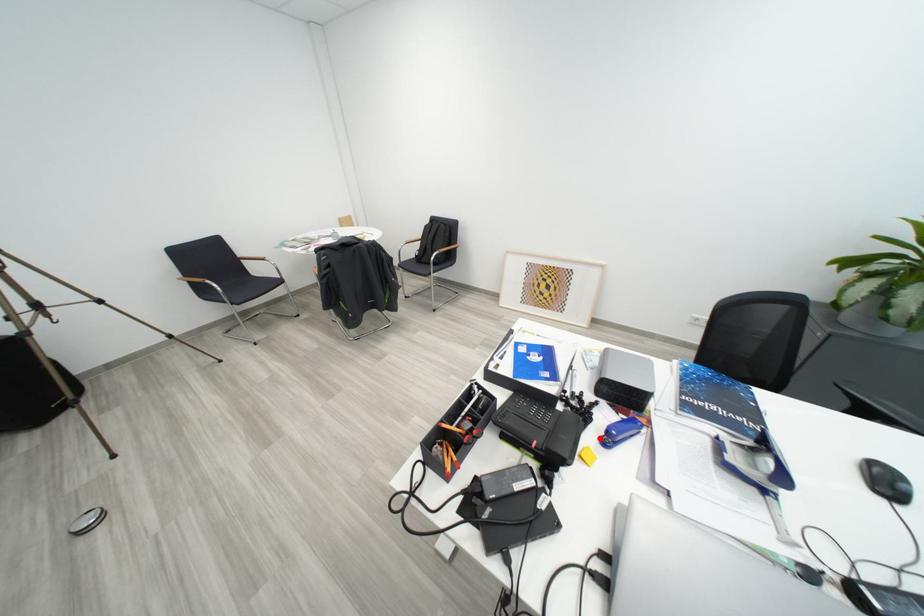
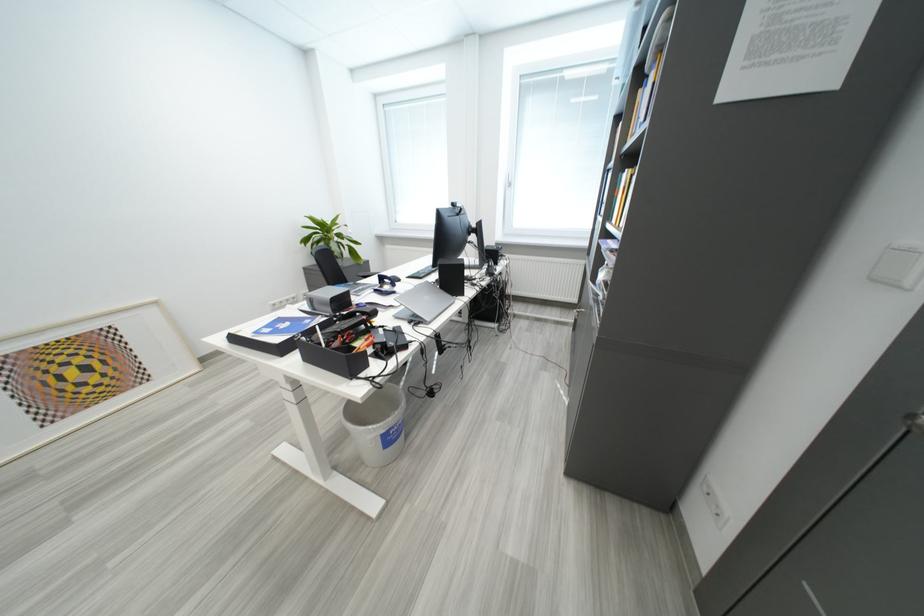
Question: I am providing you with two images of the same scene from different viewpoints. A red point is marked on the first image. Can you still see the location of the red point in image 2?

Choices:
 (A) Yes
 (B) No

Answer: (B)